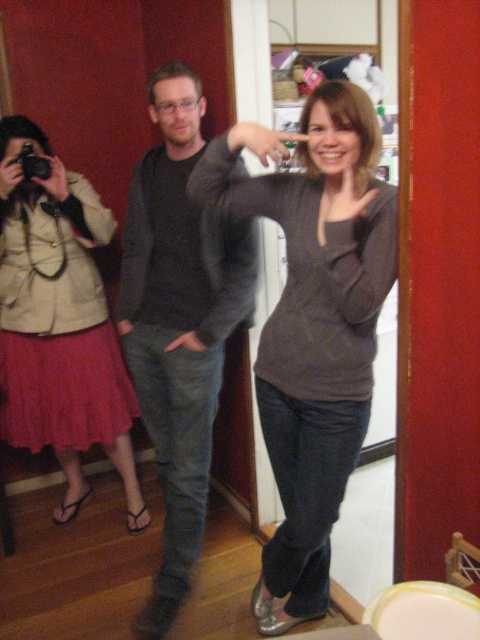
Question: Is dark gray sweater at center behind matte beige jacket at left?

Choices:
 (A) no
 (B) yes

Answer: (A)

Question: Can you confirm if dark gray sweater at center is positioned to the left of matte beige jacket at left?

Choices:
 (A) no
 (B) yes

Answer: (A)

Question: Which point is closer to the camera taking this photo?

Choices:
 (A) (177, 148)
 (B) (168, 589)

Answer: (B)

Question: Considering the relative positions of dark gray sweater at center and matte beige jacket at left in the image provided, where is dark gray sweater at center located with respect to matte beige jacket at left?

Choices:
 (A) right
 (B) left

Answer: (A)

Question: Which object appears closest to the camera in this image?

Choices:
 (A) matte gray sweater at center
 (B) matte beige jacket at left

Answer: (A)

Question: Estimate the real-world distances between objects in this image. Which object is closer to the matte beige jacket at left?

Choices:
 (A) matte gray sweater at center
 (B) dark gray sweater at center

Answer: (B)